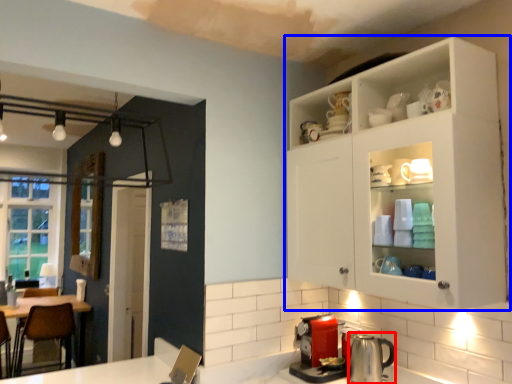
Question: Which point is further to the camera, appliance (highlighted by a red box) or cabinetry (highlighted by a blue box)?

Choices:
 (A) appliance
 (B) cabinetry

Answer: (A)